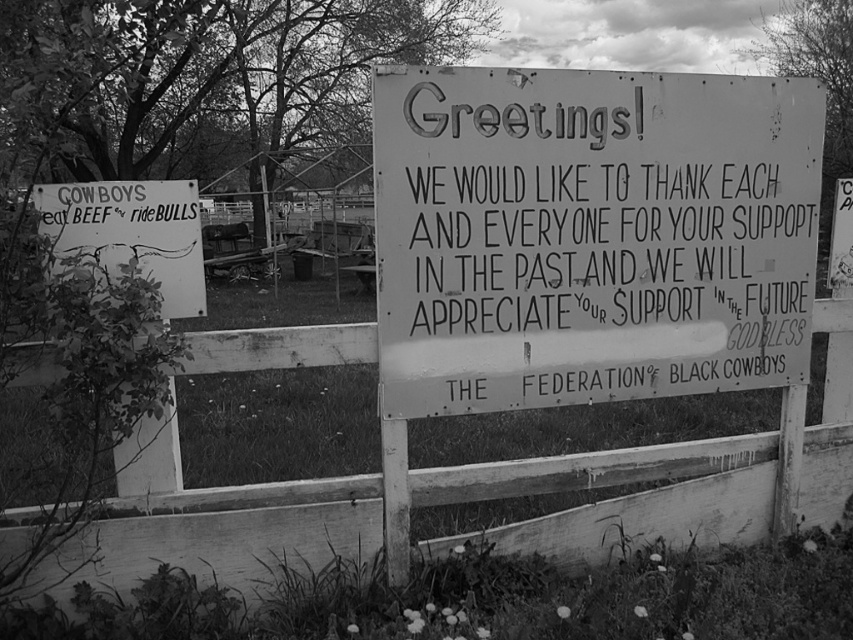
Which is behind, point (241, 500) or point (164, 182)?

Positioned behind is point (241, 500).

Is point (165, 531) less distant than point (86, 209)?

No, it is behind (86, 209).

Between point (204, 536) and point (149, 186), which one is positioned behind?

Point (204, 536)

The height and width of the screenshot is (640, 853). Find the location of `white wooden fence at center`. white wooden fence at center is located at coordinates click(x=480, y=499).

Measure the distance from white paper sign at center to rusty metal signboard at left.

They are 5.42 feet apart.

Does white paper sign at center have a greater width compared to rusty metal signboard at left?

Indeed, white paper sign at center has a greater width compared to rusty metal signboard at left.

Who is more forward, (x=735, y=323) or (x=171, y=234)?

Point (x=171, y=234)

The height and width of the screenshot is (640, 853). Identify the location of white paper sign at center. (590, 234).

Can you confirm if white paper sign at center is positioned to the right of white wooden fence at center?

Correct, you'll find white paper sign at center to the right of white wooden fence at center.

How distant is white paper sign at center from white wooden fence at center?

white paper sign at center is 22.29 inches away from white wooden fence at center.

You are a GUI agent. You are given a task and a screenshot of the screen. Output one action in this format:
    pyautogui.click(x=<x>, y=<y>)
    Task: Click on the white paper sign at center
    The width and height of the screenshot is (853, 640).
    Given the screenshot: What is the action you would take?
    pyautogui.click(x=590, y=234)